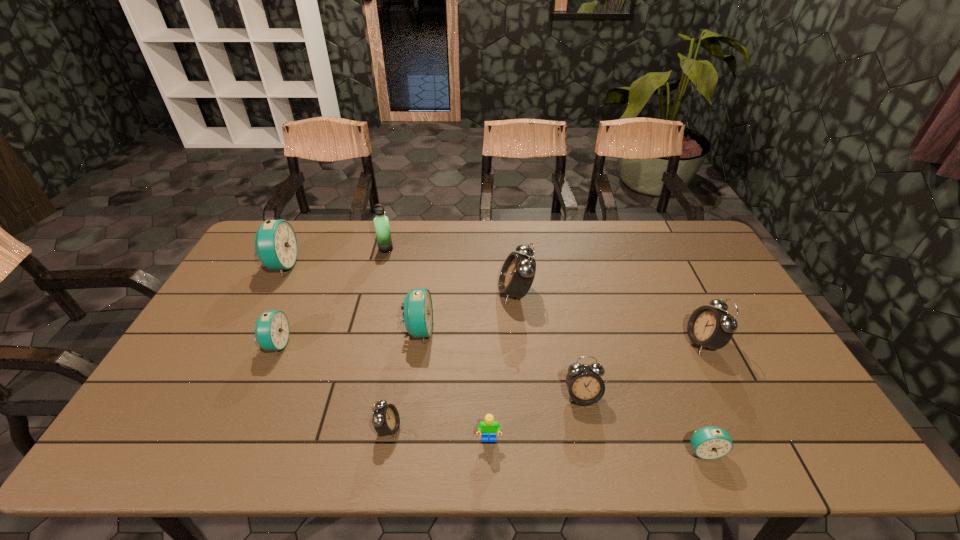
Where is `free space that is in between the leftmost alarm clock and the sixth object from left to right`? This screenshot has height=540, width=960. free space that is in between the leftmost alarm clock and the sixth object from left to right is located at coordinates (385, 353).

The width and height of the screenshot is (960, 540). What are the coordinates of `unoccupied position between the third object from left to right and the biggest white alarm clock` in the screenshot? It's located at (450, 271).

Identify which object is the closest to the seventh alarm clock from right to left. Please provide its 2D coordinates. Your answer should be formatted as a tuple, i.e. [(x, y)], where the tuple contains the x and y coordinates of a point satisfying the conditions above.

[(276, 246)]

The image size is (960, 540). What are the coordinates of `object that stands as the closest to the rightmost white alarm clock` in the screenshot? It's located at (711, 442).

Select which alarm clock is the fifth closest to the third blue alarm clock from right to left. Please provide its 2D coordinates. Your answer should be formatted as a tuple, i.e. [(x, y)], where the tuple contains the x and y coordinates of a point satisfying the conditions above.

[(585, 385)]

Locate which alarm clock is the sixth closest to the third smallest blue alarm clock. Please provide its 2D coordinates. Your answer should be formatted as a tuple, i.e. [(x, y)], where the tuple contains the x and y coordinates of a point satisfying the conditions above.

[(711, 442)]

Locate an element on the screen. The height and width of the screenshot is (540, 960). the closest blue alarm clock relative to the fourth alarm clock from right to left is located at coordinates (418, 311).

Image resolution: width=960 pixels, height=540 pixels. Identify the location of blue alarm clock that is the third closest to the second blue alarm clock from right to left. (711, 442).

The width and height of the screenshot is (960, 540). In order to click on white alarm clock that stands as the closest to the nearest white alarm clock in this screenshot , I will do `click(585, 385)`.

Select which white alarm clock is the second closest to the green Lego. Please provide its 2D coordinates. Your answer should be formatted as a tuple, i.e. [(x, y)], where the tuple contains the x and y coordinates of a point satisfying the conditions above.

[(386, 420)]